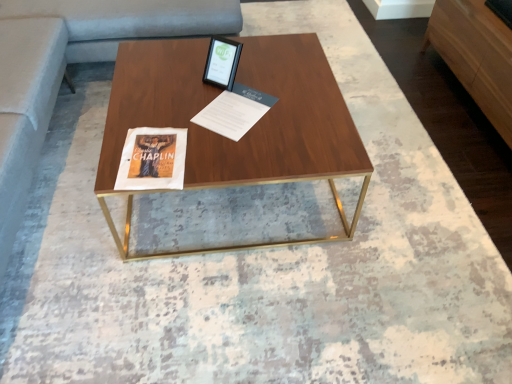
Image resolution: width=512 pixels, height=384 pixels. Find the location of `free space between matte black tablet at upper center and white paper at center`. free space between matte black tablet at upper center and white paper at center is located at coordinates (207, 92).